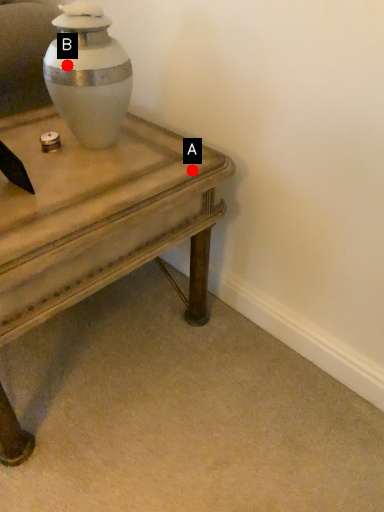
Question: Two points are circled on the image, labeled by A and B beside each circle. Which point is further to the camera?

Choices:
 (A) A is further
 (B) B is further

Answer: (A)